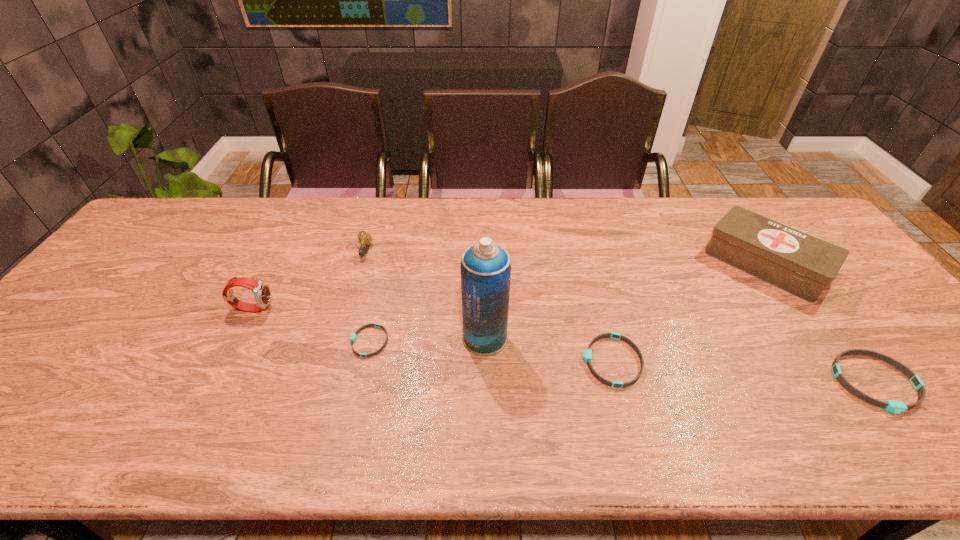
Where is `free space for a new wristband on the left`? This screenshot has height=540, width=960. free space for a new wristband on the left is located at coordinates (144, 323).